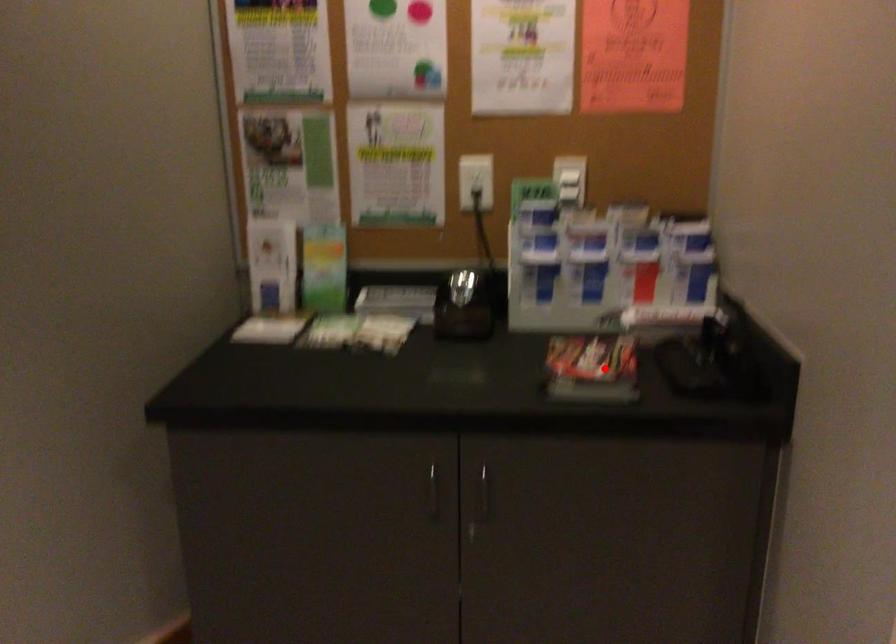
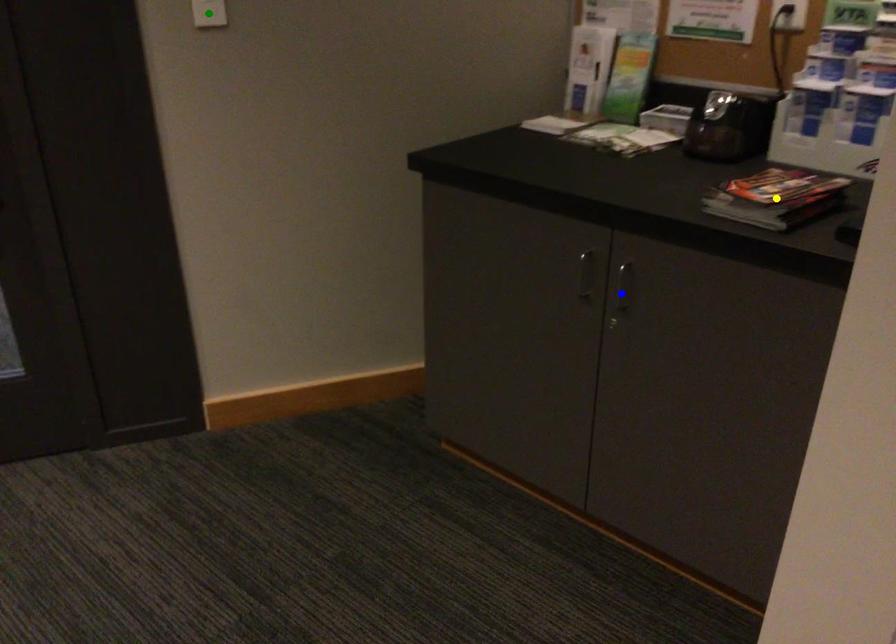
Question: I am providing you with two images of the same scene from different viewpoints. A red point is marked on the first image. You are given multiple points on the second image. Can you choose the point in image 2 that corresponds to the point in image 1?

Choices:
 (A) green point
 (B) blue point
 (C) yellow point

Answer: (C)